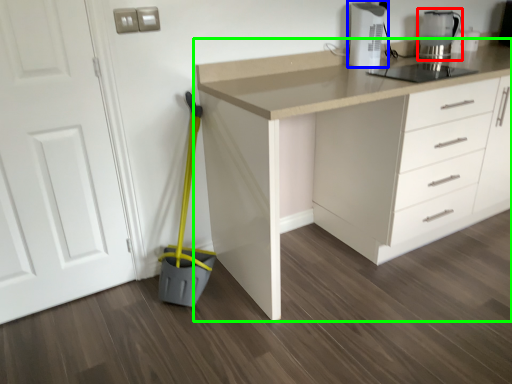
Question: Which is farther away from kitchen appliance (highlighted by a red box)? home appliance (highlighted by a blue box) or countertop (highlighted by a green box)?

Choices:
 (A) home appliance
 (B) countertop

Answer: (B)